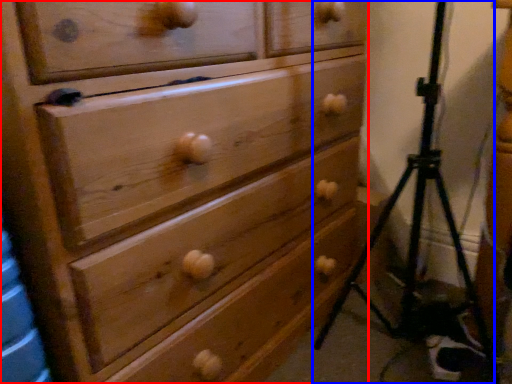
Question: Which object is closer to the camera taking this photo, chest of drawers (highlighted by a red box) or tripod (highlighted by a blue box)?

Choices:
 (A) chest of drawers
 (B) tripod

Answer: (A)